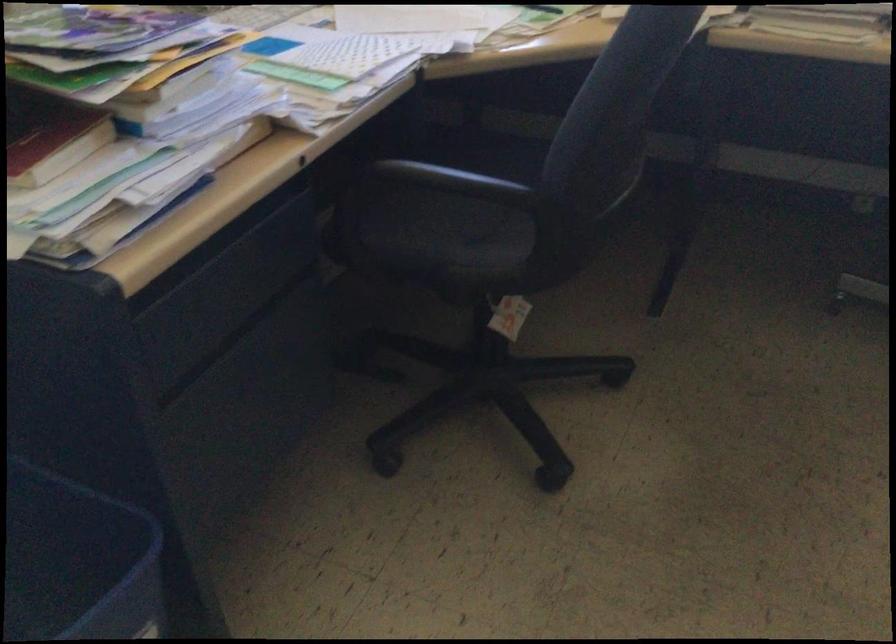
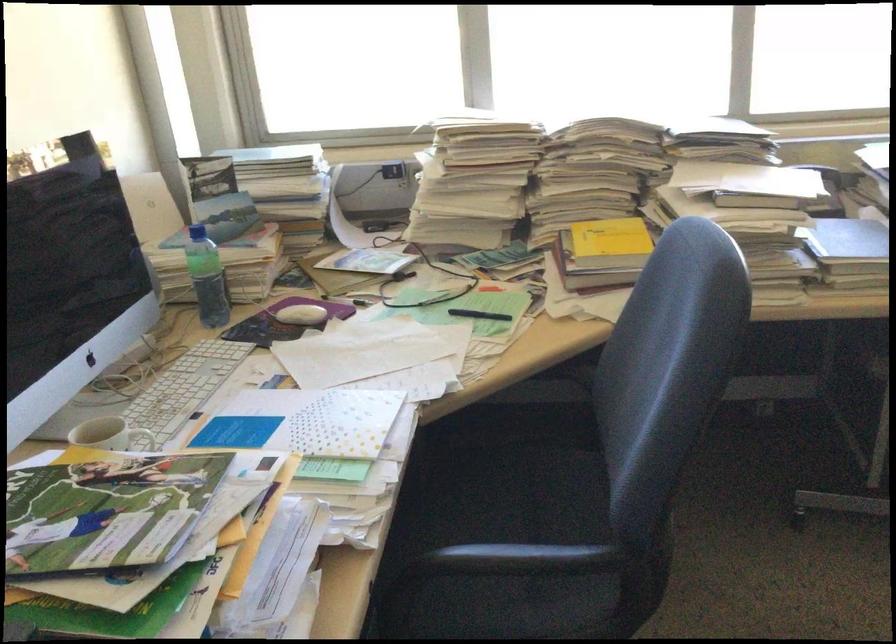
The images are taken continuously from a first-person perspective. In which direction are you moving?

The cameraman walked toward left, forward.